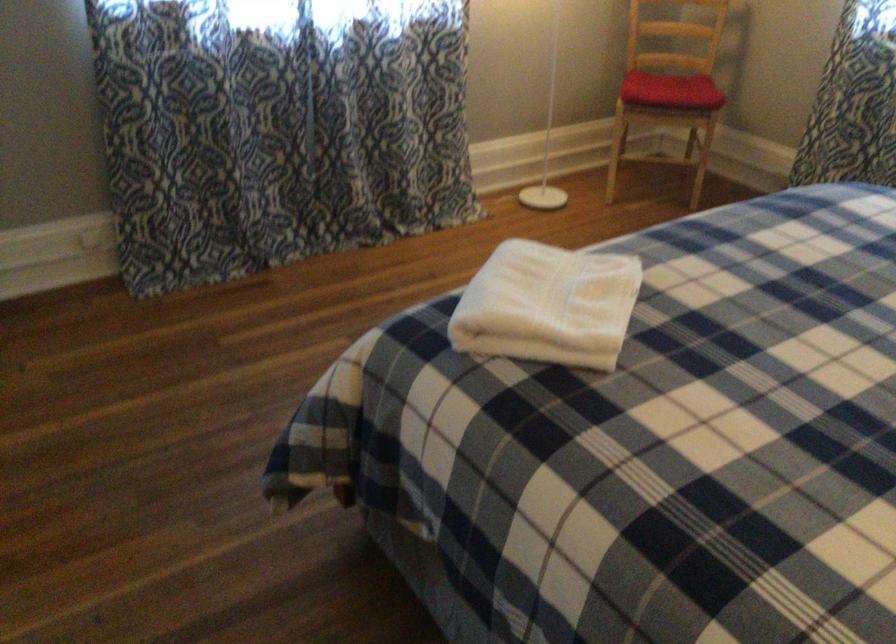
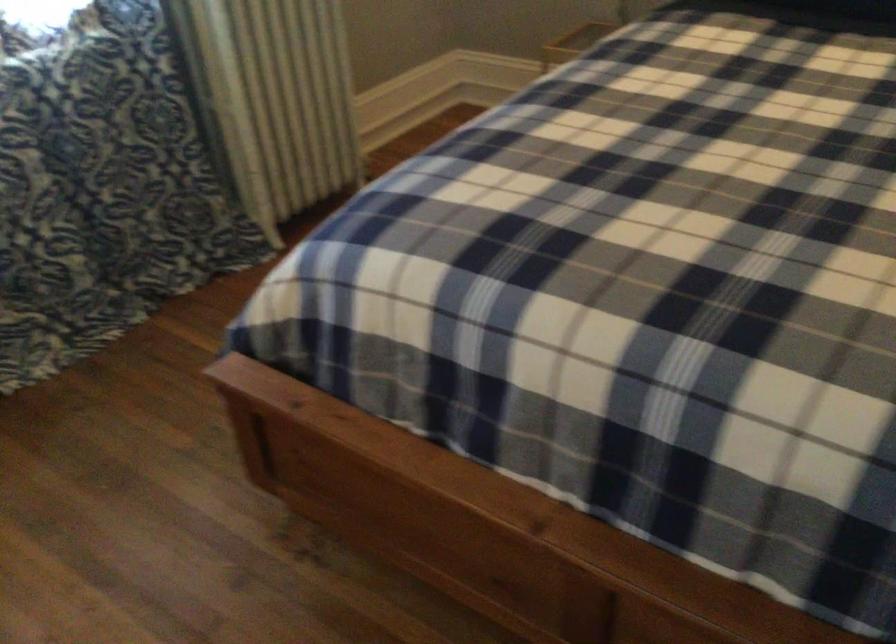
Where in the second image is the point corresponding to (x=727, y=234) from the first image?

(633, 279)